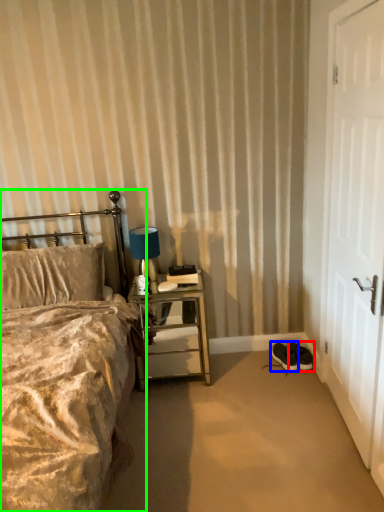
Question: Considering the real-world distances, which object is farthest from footwear (highlighted by a red box)? footwear (highlighted by a blue box) or bed (highlighted by a green box)?

Choices:
 (A) footwear
 (B) bed

Answer: (B)